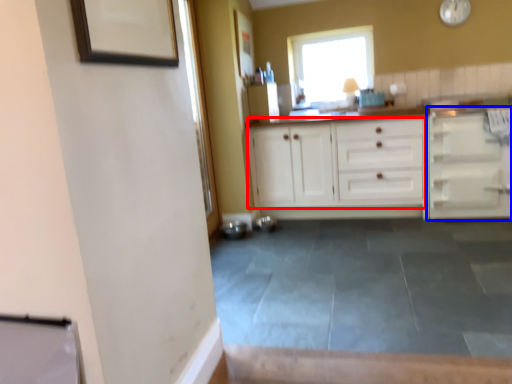
Question: Which of the following is the farthest to the observer, cabinetry (highlighted by a red box) or cabinetry (highlighted by a blue box)?

Choices:
 (A) cabinetry
 (B) cabinetry

Answer: (A)